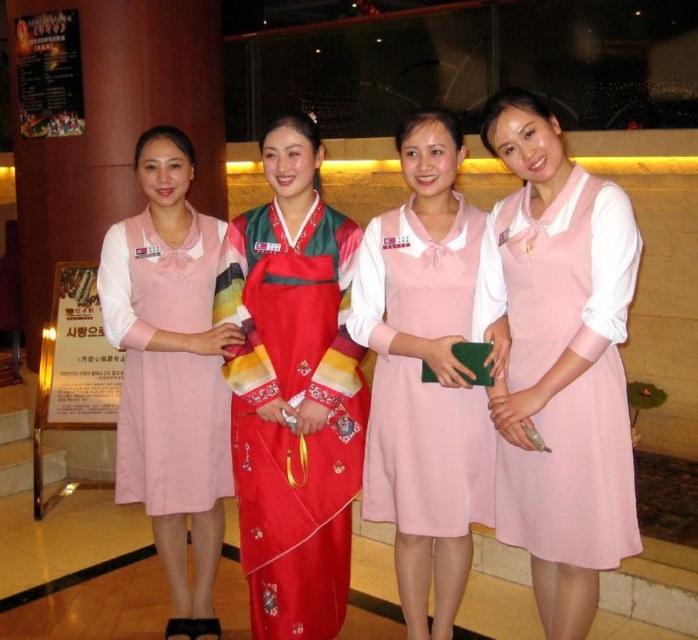
Does pink fabric dress at right lie behind pink fabric dress at center?

No, pink fabric dress at right is closer to the viewer.

Which is below, pink fabric dress at right or pink fabric dress at center?

pink fabric dress at center

At what (x,y) coordinates should I click in order to perform the action: click on pink fabric dress at right. Please return your answer as a coordinate pair (x, y). Looking at the image, I should click on (572, 380).

Between point (260, 264) and point (556, 336), which one is positioned behind?

The point (260, 264) is more distant.

Between point (251, 240) and point (632, 522), which one is positioned in front?

Point (632, 522) is more forward.

In order to click on red satin hanbok at center in this screenshot , I will do `click(292, 392)`.

Can you confirm if pink fabric dress at right is smaller than matte pink dress at center?

Incorrect, pink fabric dress at right is not smaller in size than matte pink dress at center.

Is point (567, 209) positioned in front of point (406, 220)?

That is True.

You are a GUI agent. You are given a task and a screenshot of the screen. Output one action in this format:
    pyautogui.click(x=<x>, y=<y>)
    Task: Click on the pink fabric dress at right
    Image resolution: width=698 pixels, height=640 pixels.
    Given the screenshot: What is the action you would take?
    pyautogui.click(x=572, y=380)